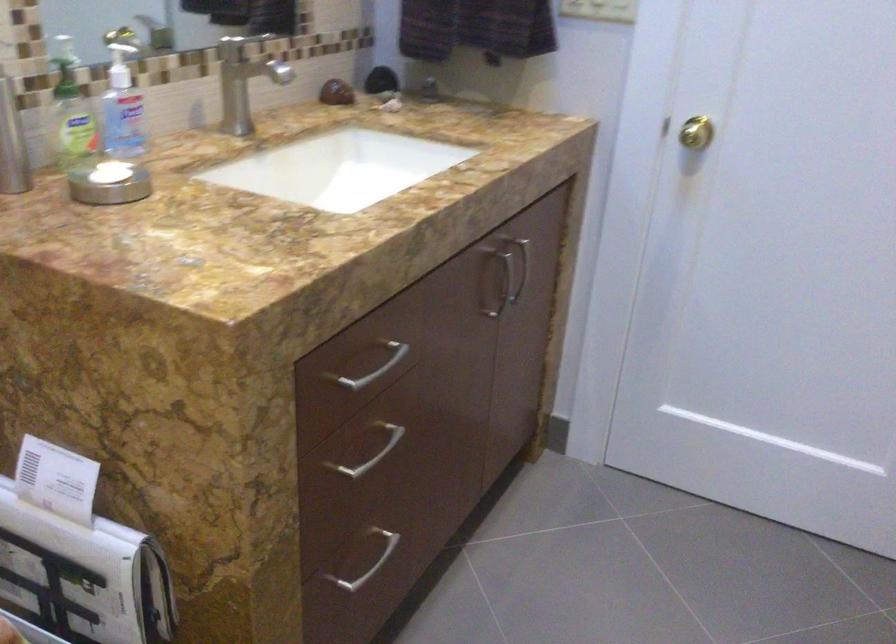
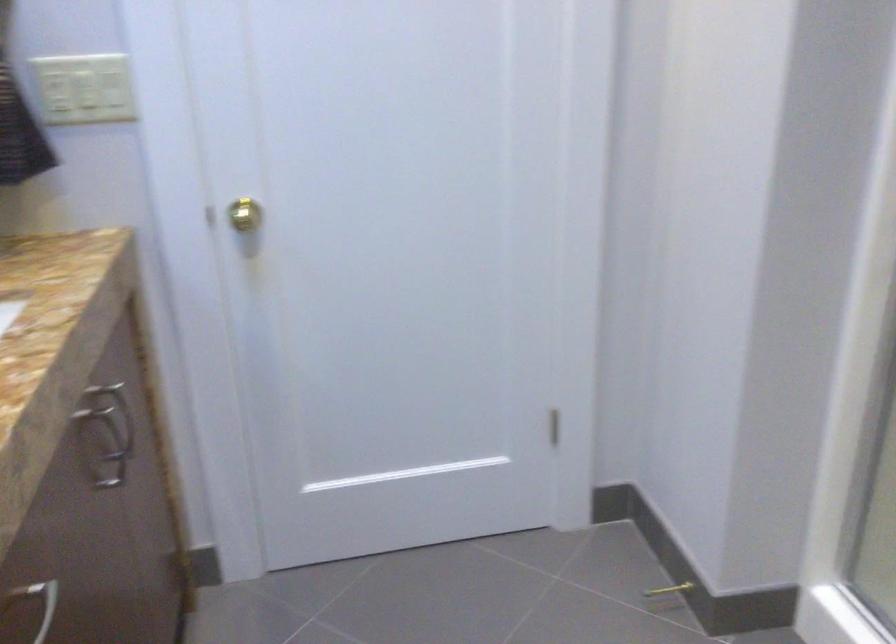
In the second image, find the point that corresponds to point 383,350 in the first image.

(37, 603)